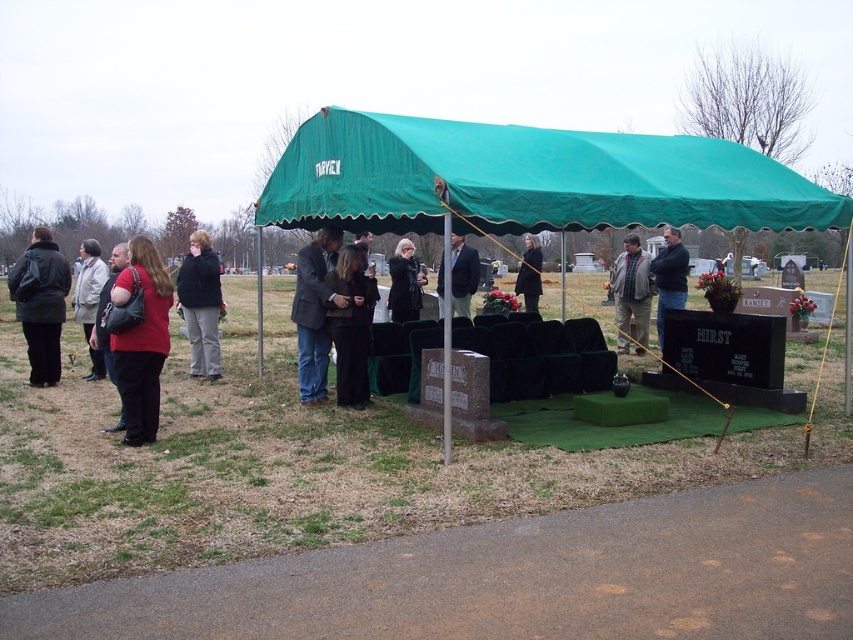
Is dark gray suit at center to the right of gray wool jacket at center from the viewer's perspective?

Incorrect, dark gray suit at center is not on the right side of gray wool jacket at center.

How much distance is there between dark gray suit at center and gray wool jacket at center?

dark gray suit at center is 5.26 meters from gray wool jacket at center.

What are the coordinates of `dark gray suit at center` in the screenshot? It's located at (x=314, y=312).

Is point (210, 352) in front of point (112, 264)?

No, it is behind (112, 264).

Who is more distant from viewer, (199, 323) or (120, 257)?

The point (199, 323) is behind.

Is point (195, 353) farther from camera compared to point (102, 305)?

Yes, it is.

Locate an element on the screen. The image size is (853, 640). dark gray jacket at center is located at coordinates (200, 305).

Describe the element at coordinates (527, 179) in the screenshot. I see `green fabric canopy at center` at that location.

Between green fabric canopy at center and matte red shirt at center, which one is positioned lower?

Positioned lower is matte red shirt at center.

Describe the element at coordinates (527, 179) in the screenshot. The width and height of the screenshot is (853, 640). I see `green fabric canopy at center` at that location.

At what (x,y) coordinates should I click in order to perform the action: click on green fabric canopy at center. Please return your answer as a coordinate pair (x, y). The height and width of the screenshot is (640, 853). Looking at the image, I should click on (527, 179).